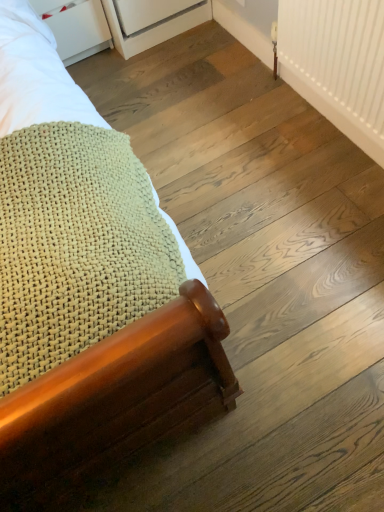
The width and height of the screenshot is (384, 512). In order to click on free space that is in between wooden bed frame at lower left and white plastic radiator at upper right in this screenshot , I will do `click(221, 158)`.